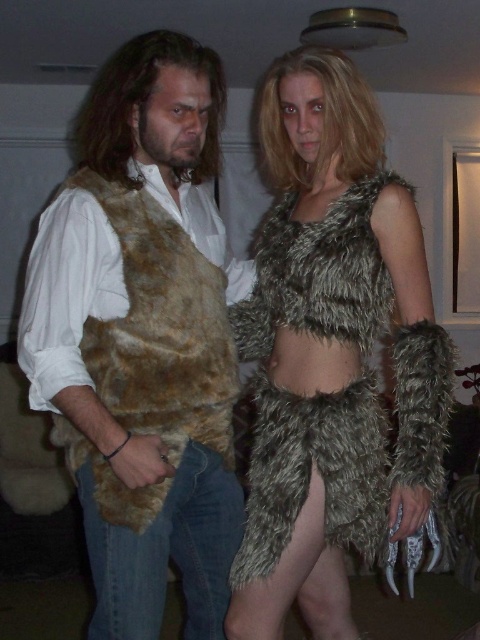
Can you confirm if fuzzy brown vest at left is thinner than fuzzy fur outfit at center?

Indeed, fuzzy brown vest at left has a lesser width compared to fuzzy fur outfit at center.

Is fuzzy brown vest at left wider than fuzzy fur outfit at center?

In fact, fuzzy brown vest at left might be narrower than fuzzy fur outfit at center.

Is point (228, 522) positioned after point (320, 444)?

Yes, it is.

Identify the location of fuzzy brown vest at left. (143, 337).